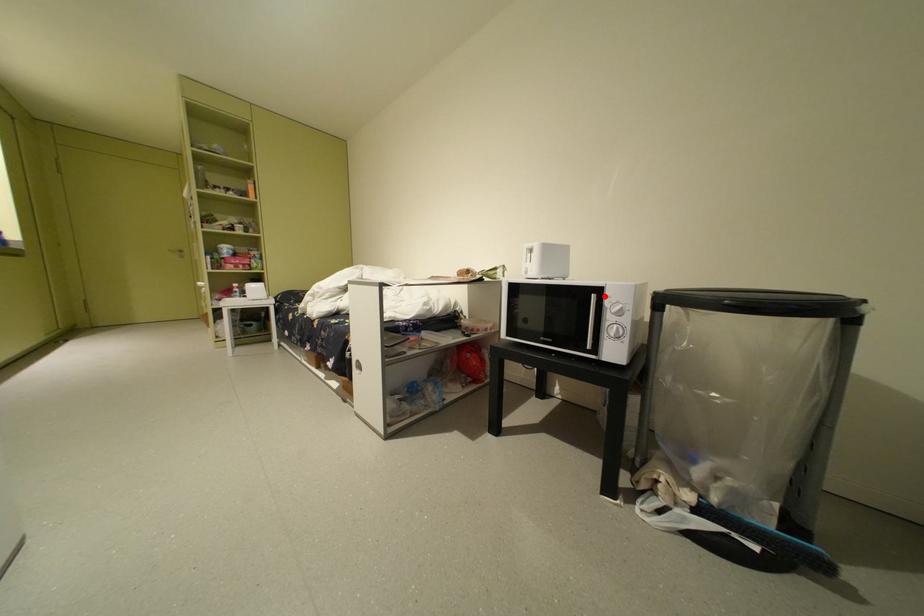
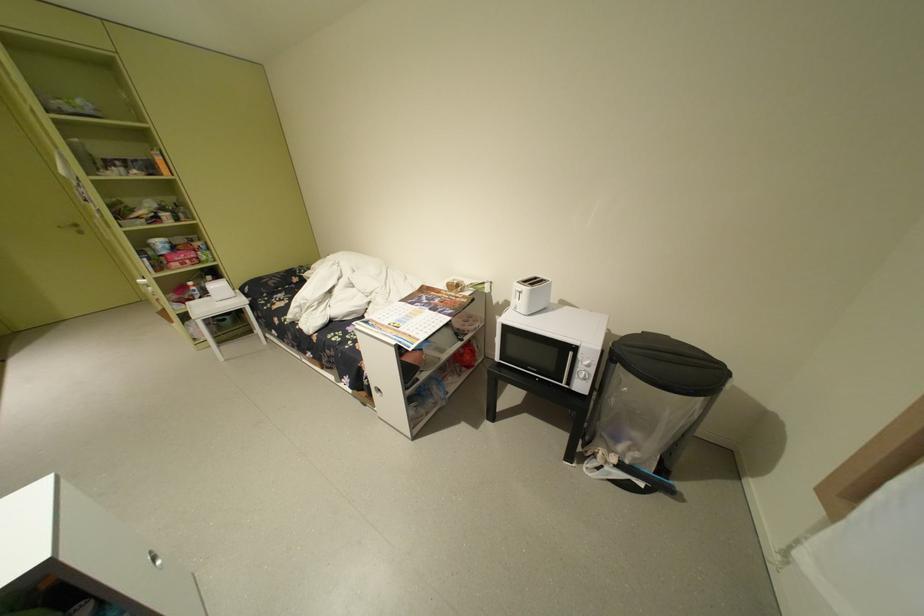
In the second image, find the point that corresponds to the highlighted location in the first image.

(581, 354)